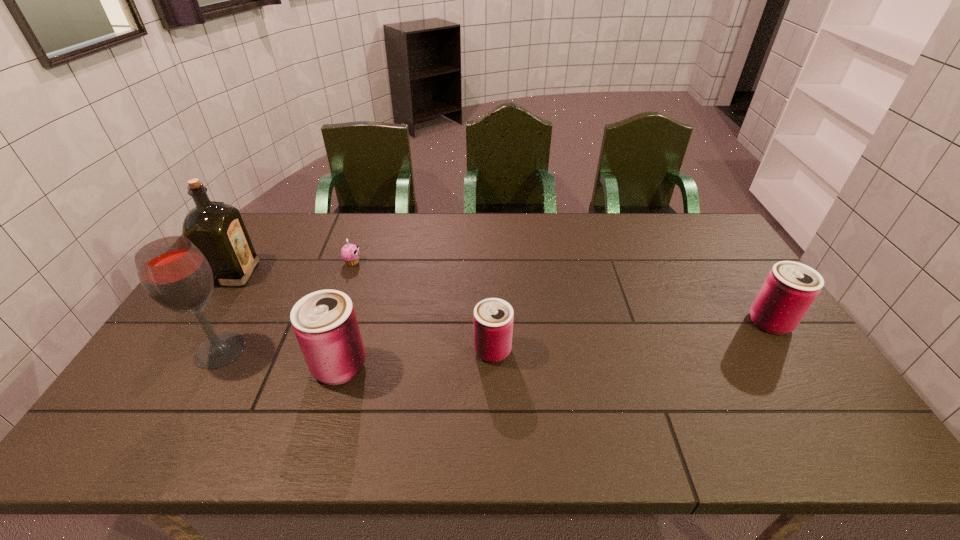
Where is `free point located on the back of the rightmost object`? The height and width of the screenshot is (540, 960). free point located on the back of the rightmost object is located at coordinates 748,289.

Find the location of a particular element. The width and height of the screenshot is (960, 540). vacant space located 0.260m on the label of the liquor is located at coordinates (334, 274).

Locate an element on the screen. vacant space located 0.390m on the right of the alcohol is located at coordinates (391, 350).

Locate an element on the screen. vacant point located on the face of the shortest object is located at coordinates (463, 262).

Find the location of a particular element. This screenshot has width=960, height=540. object located at the near edge is located at coordinates (325, 324).

Find the location of a particular element. This screenshot has width=960, height=540. liquor present at the left edge is located at coordinates (217, 229).

In order to click on alcohol that is positioned at the left edge in this screenshot , I will do `click(173, 271)`.

Locate an element on the screen. Image resolution: width=960 pixels, height=540 pixels. object situated at the right edge is located at coordinates click(x=790, y=288).

I want to click on free location at the far edge, so click(x=468, y=237).

Image resolution: width=960 pixels, height=540 pixels. I want to click on free spot at the near edge of the desktop, so click(429, 381).